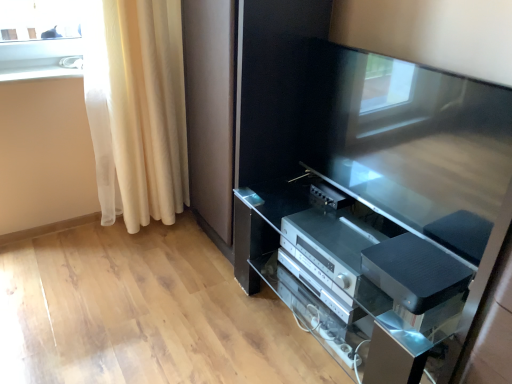
Question: Is silver metallic stereo at lower center, which is counted as the second appliance, starting from the front, wider than satin black tv at center?

Choices:
 (A) yes
 (B) no

Answer: (A)

Question: Is silver metallic stereo at lower center, which is counted as the second appliance, starting from the front, further to the viewer compared to satin black tv at center?

Choices:
 (A) no
 (B) yes

Answer: (B)

Question: Is silver metallic stereo at lower center, which is counted as the second appliance, starting from the front, smaller than satin black tv at center?

Choices:
 (A) no
 (B) yes

Answer: (B)

Question: From a real-world perspective, is silver metallic stereo at lower center, which is counted as the second appliance, starting from the front, positioned over satin black tv at center based on gravity?

Choices:
 (A) yes
 (B) no

Answer: (B)

Question: From the image's perspective, is silver metallic stereo at lower center, the first appliance viewed from the back, on satin black tv at center?

Choices:
 (A) yes
 (B) no

Answer: (B)

Question: From a real-world perspective, relative to satin black tv cabinet at center, is white glossy window sill at upper left vertically above or below?

Choices:
 (A) below
 (B) above

Answer: (B)

Question: In the image, is white glossy window sill at upper left positioned in front of or behind satin black tv cabinet at center?

Choices:
 (A) front
 (B) behind

Answer: (B)

Question: In terms of size, does white glossy window sill at upper left appear bigger or smaller than satin black tv cabinet at center?

Choices:
 (A) small
 (B) big

Answer: (A)

Question: Is point (74, 67) closer or farther from the camera than point (307, 279)?

Choices:
 (A) farther
 (B) closer

Answer: (A)

Question: From their relative heights in the image, would you say white sheer curtain at left is taller or shorter than satin black tv cabinet at center?

Choices:
 (A) short
 (B) tall

Answer: (B)

Question: In terms of width, does white sheer curtain at left look wider or thinner when compared to satin black tv cabinet at center?

Choices:
 (A) thin
 (B) wide

Answer: (A)

Question: From a real-world perspective, is white sheer curtain at left above or below satin black tv cabinet at center?

Choices:
 (A) below
 (B) above

Answer: (B)

Question: Is white sheer curtain at left situated inside satin black tv cabinet at center or outside?

Choices:
 (A) inside
 (B) outside

Answer: (B)

Question: Is satin black tv cabinet at center situated inside white sheer curtain at left or outside?

Choices:
 (A) inside
 (B) outside

Answer: (B)

Question: Is satin black tv cabinet at center wider or thinner than white sheer curtain at left?

Choices:
 (A) wide
 (B) thin

Answer: (A)